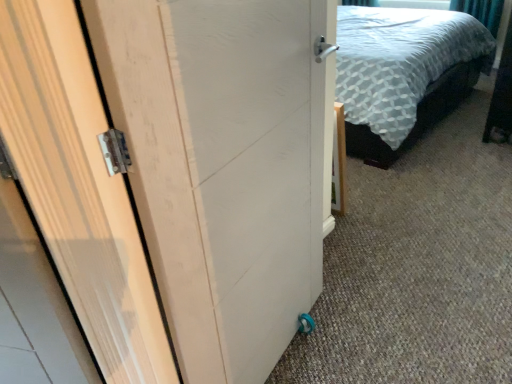
Question: Should I look upward or downward to see white wood door at center?

Choices:
 (A) up
 (B) down

Answer: (B)